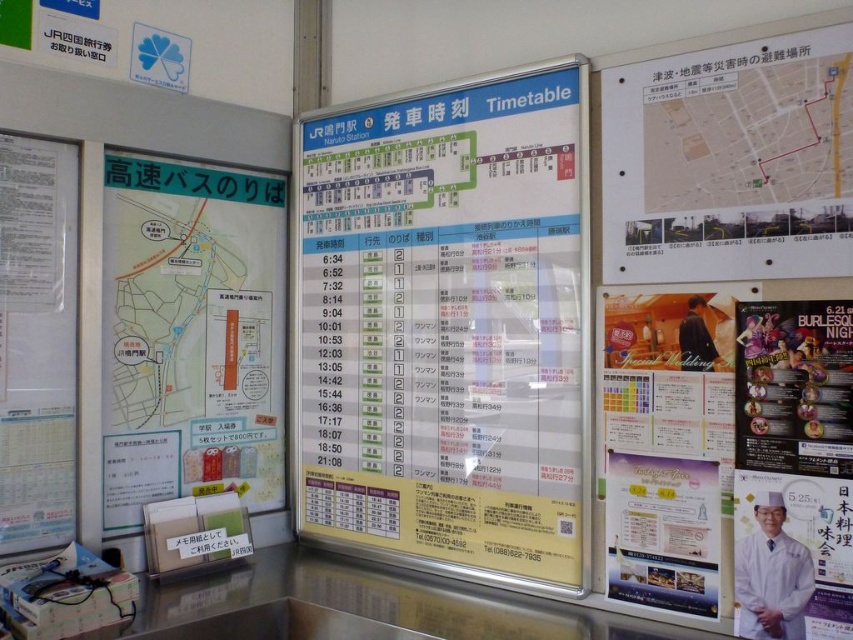
Question: Estimate the real-world distances between objects in this image. Which object is farther from the matte green map at left?

Choices:
 (A) matte brown suit at center
 (B) white paper menu at left
 (C) matte gold frame at right
 (D) white lab coat at lower right

Answer: (D)

Question: Among these points, which one is farthest from the camera?

Choices:
 (A) (276, 220)
 (B) (697, 396)

Answer: (A)

Question: Can you confirm if white lab coat at lower right is smaller than matte brown suit at center?

Choices:
 (A) yes
 (B) no

Answer: (B)

Question: Which point is closer to the camera?

Choices:
 (A) matte brown suit at center
 (B) matte green map at left
 (C) white paper menu at left

Answer: (A)

Question: Can you confirm if white paper timetable at center is positioned to the left of white paper menu at left?

Choices:
 (A) no
 (B) yes

Answer: (A)

Question: From the image, what is the correct spatial relationship of white paper menu at left in relation to matte brown suit at center?

Choices:
 (A) above
 (B) below

Answer: (B)